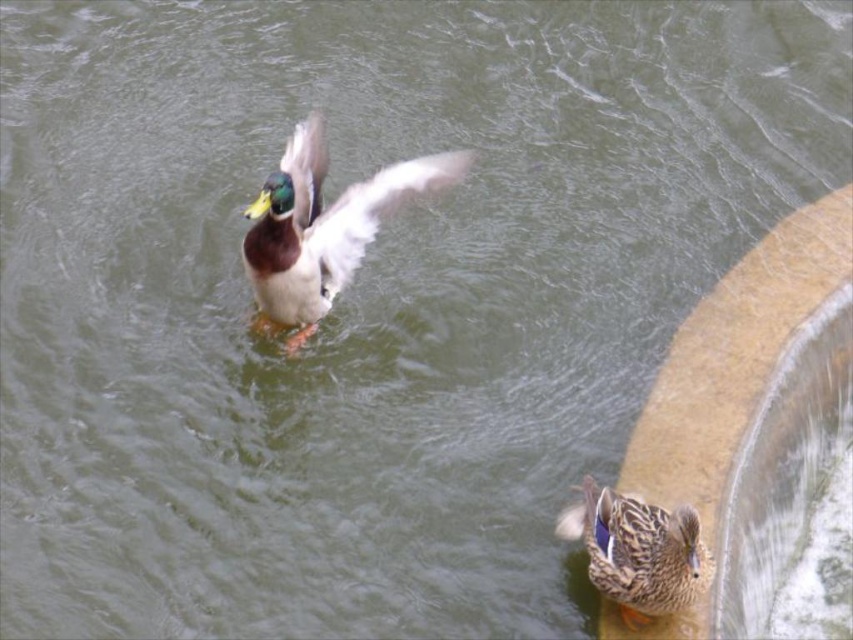
You are a photographer aiming to capture the shiny green duck at upper center. You have a camera with a zoom lens. The camera is currently focused on the point at coordinates point [321,227]. Is the camera focused on the shiny green duck at upper center?

Yes, the point at coordinates point [321,227] indicates the shiny green duck at upper center, so the camera is focused on it.

You are holding a camera and want to take a photo of the shiny green duck at upper center. If you are standing 5 meters away from the duck, will you be able to capture it in your photo without moving closer?

The shiny green duck at upper center and camera are 5.55 meters apart from each other. Since you are standing 5 meters away, you are closer than the required distance. Therefore, you can capture the shiny green duck at upper center in your photo without moving closer.

You are a photographer trying to capture the shiny green duck at upper center. Based on the coordinates provided, where should you aim your camera relative to the center of the image?

The shiny green duck at upper center is located at point coordinates 0.356 on the horizontal axis and 0.377 on the vertical axis. This means it is positioned slightly to the left and above the center of the image. To capture it, aim your camera slightly left and upwards from the center.